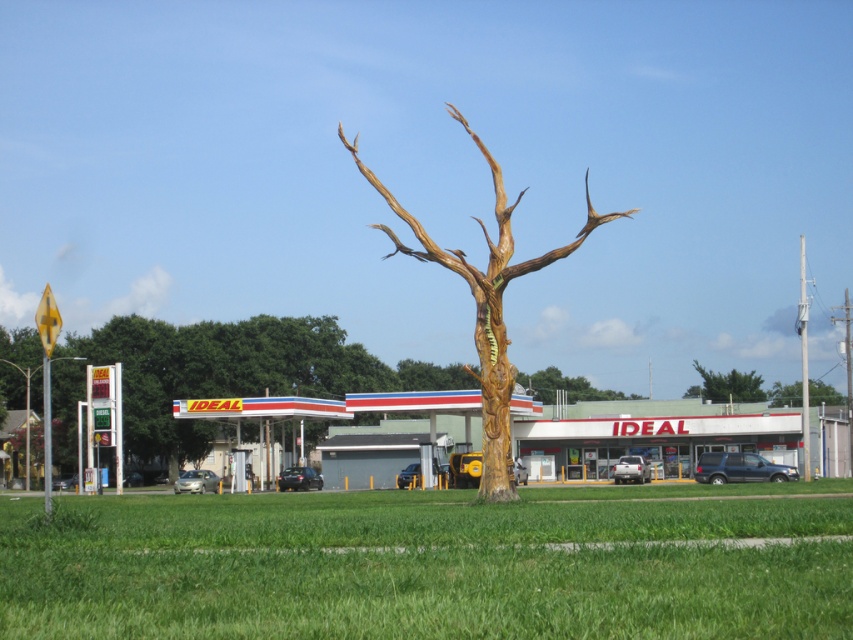
Is matte white gas station at center smaller than wooden tree trunk at center?

Actually, matte white gas station at center might be larger than wooden tree trunk at center.

Describe the element at coordinates (653, 433) in the screenshot. The image size is (853, 640). I see `matte white gas station at center` at that location.

In the scene shown: Who is more distant from viewer, (344, 416) or (506, 340)?

The point (344, 416) is behind.

At what (x,y) coordinates should I click in order to perform the action: click on matte white gas station at center. Please return your answer as a coordinate pair (x, y). This screenshot has height=640, width=853. Looking at the image, I should click on (653, 433).

Looking at this image, between wooden textured tree at center and green textured tree at upper center, which one appears on the left side from the viewer's perspective?

wooden textured tree at center

Identify the location of wooden textured tree at center. Image resolution: width=853 pixels, height=640 pixels. (485, 305).

Which is behind, point (421, 237) or point (496, 177)?

The point (421, 237) is more distant.

Describe the element at coordinates (485, 305) in the screenshot. This screenshot has width=853, height=640. I see `wooden textured tree at center` at that location.

Where is `wooden textured tree at center`? This screenshot has height=640, width=853. wooden textured tree at center is located at coordinates (485, 305).